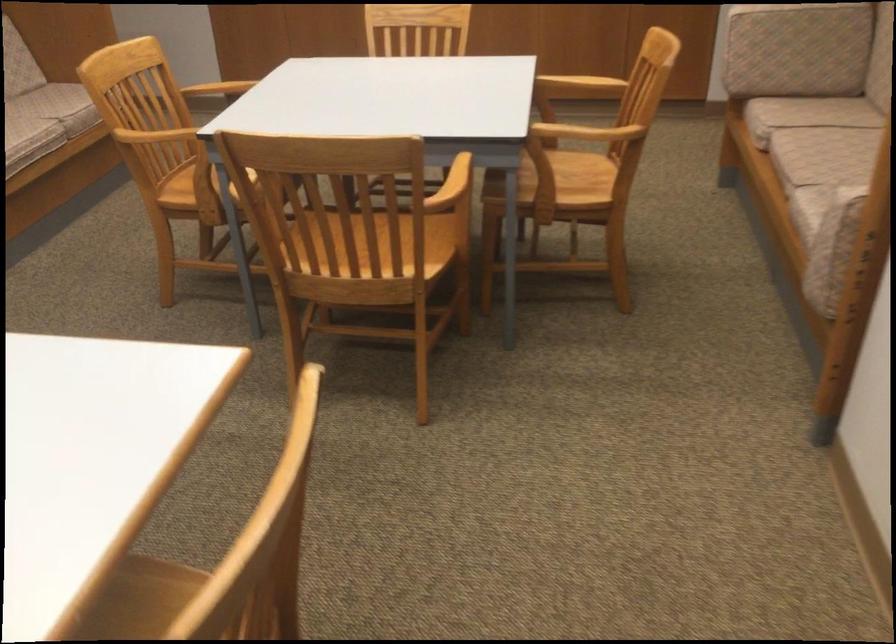
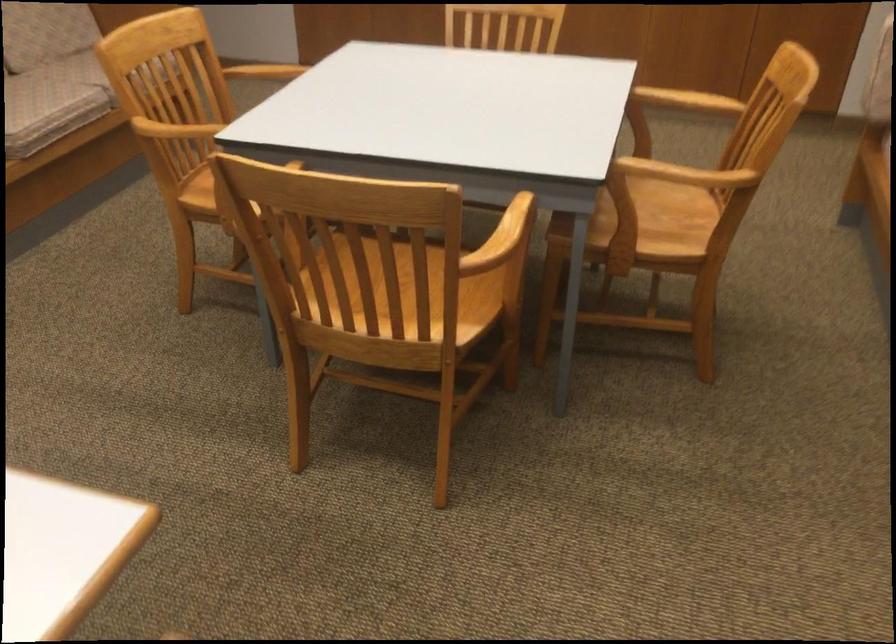
Question: The camera is either moving clockwise (left) or counter-clockwise (right) around the object. The first image is from the beginning of the video and the second image is from the end. Is the camera moving left or right when shooting the video?

Choices:
 (A) Left
 (B) Right

Answer: (B)